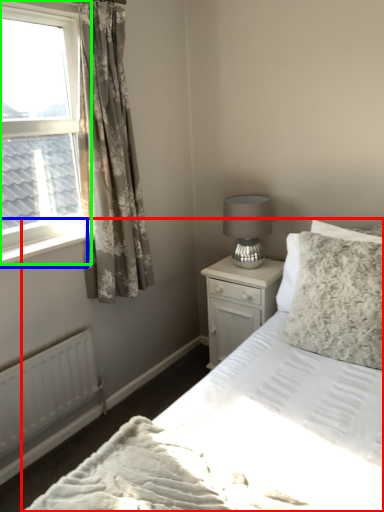
Question: Based on their relative distances, which object is nearer to bed (highlighted by a red box)? Choose from window sill (highlighted by a blue box) and window (highlighted by a green box).

Choices:
 (A) window sill
 (B) window

Answer: (A)